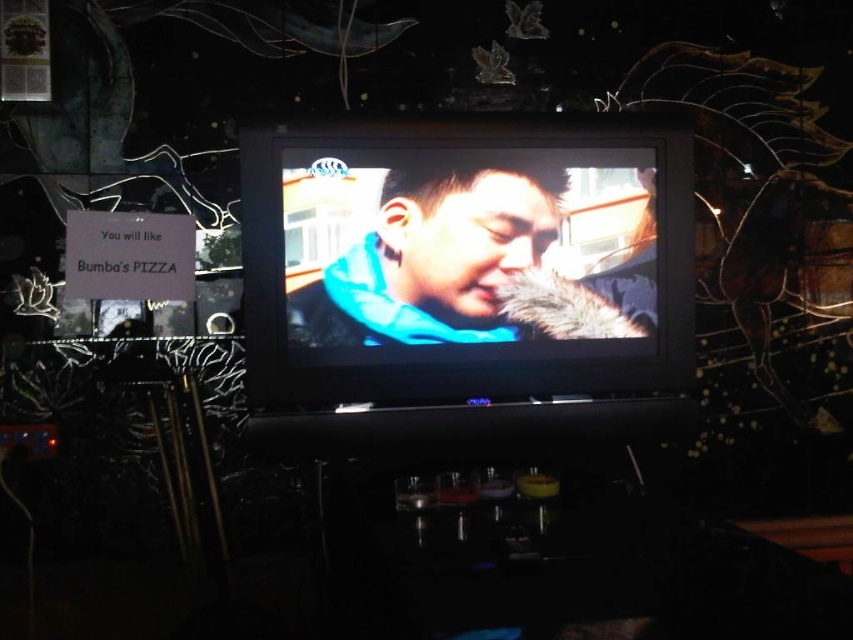
You are a delivery person who needs to place a small package between the matte black tv at center and the blue matte scarf at center. The package is 2 inches wide. Do you think it will fit in the space between them?

The distance between the matte black tv at center and the blue matte scarf at center is 1.99 inches, which is slightly less than the 2 inch width of the package. Therefore, the package will not fit between them.